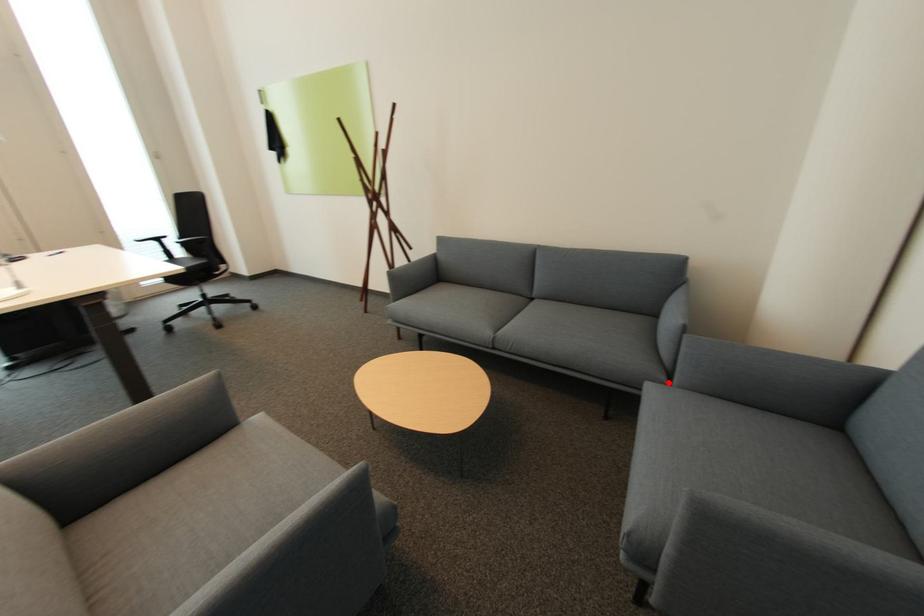
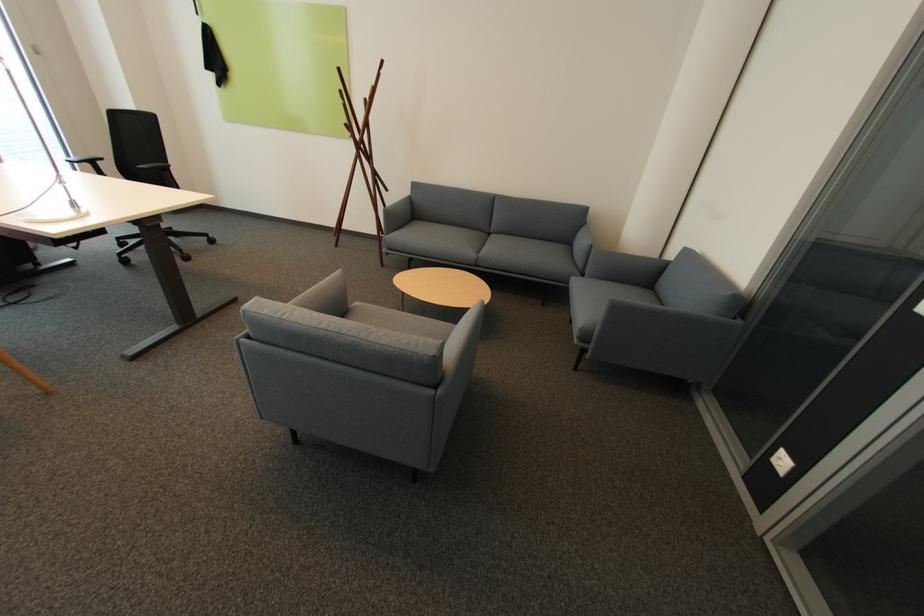
Where in the second image is the point corresponding to the highlighted location from the first image?

(585, 277)